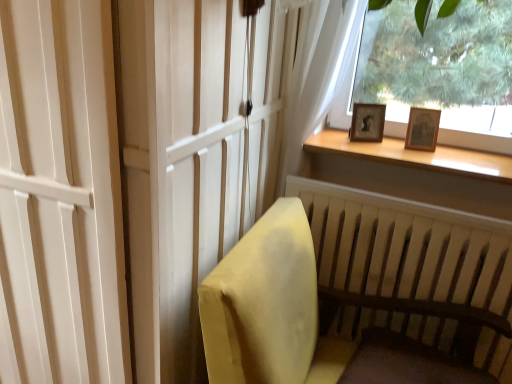
Question: Is velvet yellow chair at lower right inside the boundaries of wooden photo frame at upper right, or outside?

Choices:
 (A) outside
 (B) inside

Answer: (A)

Question: From a real-world perspective, is velvet yellow chair at lower right physically located above or below wooden photo frame at upper right?

Choices:
 (A) above
 (B) below

Answer: (B)

Question: Which of these objects is positioned closest to the wooden frame at upper right?

Choices:
 (A) white sheer curtain at upper right
 (B) dark wood footrest at lower right
 (C) white matte screen door at left
 (D) wooden at upper right
 (E) wooden photo frame at upper right

Answer: (D)

Question: Which object is positioned closest to the dark wood footrest at lower right?

Choices:
 (A) wooden at upper right
 (B) white matte screen door at left
 (C) wooden photo frame at upper right
 (D) white sheer curtain at upper right
 (E) velvet yellow chair at lower right

Answer: (E)